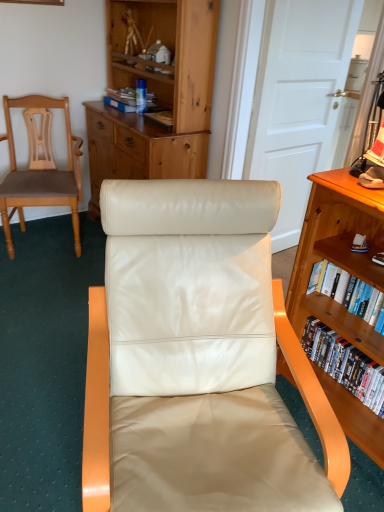
Locate an element on the screen. The image size is (384, 512). satin white leather chair at center, the 1th chair in the front-to-back sequence is located at coordinates (189, 312).

The image size is (384, 512). Describe the element at coordinates (298, 99) in the screenshot. I see `white wood door at upper center` at that location.

What do you see at coordinates (368, 139) in the screenshot? I see `metallic silver lamp at upper right` at bounding box center [368, 139].

Image resolution: width=384 pixels, height=512 pixels. Describe the element at coordinates (338, 254) in the screenshot. I see `wooden bookshelf at right` at that location.

Where is `satin white leather chair at center, which is the second chair in back-to-front order`? satin white leather chair at center, which is the second chair in back-to-front order is located at coordinates (189, 312).

Is matte brown wood chair at left, which is the second chair from front to back, not near satin white leather chair at center, the 1th chair in the front-to-back sequence?

Yes, matte brown wood chair at left, which is the second chair from front to back, and satin white leather chair at center, the 1th chair in the front-to-back sequence, are quite far apart.

From a real-world perspective, is matte brown wood chair at left, which is the second chair from front to back, positioned above or below satin white leather chair at center, marked as the second chair in a left-to-right arrangement?

matte brown wood chair at left, which is the second chair from front to back, is below satin white leather chair at center, marked as the second chair in a left-to-right arrangement.

From the image's perspective, which one is positioned lower, matte brown wood chair at left, the second chair viewed from the right, or satin white leather chair at center, marked as the second chair in a left-to-right arrangement?

satin white leather chair at center, marked as the second chair in a left-to-right arrangement, is shown below in the image.

Is point (377, 110) closer to camera compared to point (103, 434)?

No, it is not.

Considering the sizes of objects metallic silver lamp at upper right and satin white leather chair at center, the 1th chair in the front-to-back sequence, in the image provided, who is taller, metallic silver lamp at upper right or satin white leather chair at center, the 1th chair in the front-to-back sequence,?

satin white leather chair at center, the 1th chair in the front-to-back sequence.

Locate an element on the screen. lamp above the satin white leather chair at center, marked as the second chair in a left-to-right arrangement (from the image's perspective) is located at coordinates (368, 139).

Can you confirm if metallic silver lamp at upper right is taller than white glossy bookshelf at right, marked as the third book in a left-to-right arrangement?

Indeed, metallic silver lamp at upper right has a greater height compared to white glossy bookshelf at right, marked as the third book in a left-to-right arrangement.

Is metallic silver lamp at upper right facing away from white glossy bookshelf at right, marked as the third book in a left-to-right arrangement?

That's not correct — metallic silver lamp at upper right is not looking away from white glossy bookshelf at right, marked as the third book in a left-to-right arrangement.

Does metallic silver lamp at upper right have a smaller size compared to white glossy bookshelf at right, arranged as the first book when ordered from the bottom?

Indeed, metallic silver lamp at upper right has a smaller size compared to white glossy bookshelf at right, arranged as the first book when ordered from the bottom.

From the image's perspective, which one is positioned lower, metallic silver lamp at upper right or white glossy bookshelf at right, positioned as the 2th book in back-to-front order?

From the image's view, white glossy bookshelf at right, positioned as the 2th book in back-to-front order, is below.

Would you say matte brown wood chair at left, which is the second chair from front to back, contains white glossy bookshelf at right, positioned as the 2th book in back-to-front order?

That's incorrect, white glossy bookshelf at right, positioned as the 2th book in back-to-front order, is not inside matte brown wood chair at left, which is the second chair from front to back.

Would you consider matte brown wood chair at left, which is the second chair from front to back, to be distant from white glossy bookshelf at right, which appears as the first book when viewed from the right?

matte brown wood chair at left, which is the second chair from front to back, is positioned a significant distance from white glossy bookshelf at right, which appears as the first book when viewed from the right.

This screenshot has width=384, height=512. Find the location of `the 2nd chair to the left when counting from the white glossy bookshelf at right, which appears as the first book when viewed from the right`. the 2nd chair to the left when counting from the white glossy bookshelf at right, which appears as the first book when viewed from the right is located at coordinates (40, 168).

From a real-world perspective, relative to matte brown wood chair at left, which is the first chair in back-to-front order, is metallic silver lamp at upper right vertically above or below?

From a real-world perspective, metallic silver lamp at upper right is physically above matte brown wood chair at left, which is the first chair in back-to-front order.

Between metallic silver lamp at upper right and matte brown wood chair at left, which is the second chair from front to back, which one has more height?

matte brown wood chair at left, which is the second chair from front to back, is taller.

Could you tell me if metallic silver lamp at upper right is facing matte brown wood chair at left, the second chair viewed from the right?

No, metallic silver lamp at upper right is not oriented towards matte brown wood chair at left, the second chair viewed from the right.

I want to click on the 2nd chair to the left of the metallic silver lamp at upper right, counting from the anchor's position, so click(x=40, y=168).

Identify the location of door that appears behind the satin white leather chair at center, the first chair positioned from the right. (298, 99).

Which is closer to the camera, (302, 59) or (299, 351)?

Point (299, 351)

Based on the photo, does white wood door at upper center appear on the left side of satin white leather chair at center, marked as the second chair in a left-to-right arrangement?

In fact, white wood door at upper center is to the right of satin white leather chair at center, marked as the second chair in a left-to-right arrangement.

Between white wood door at upper center and satin white leather chair at center, the first chair positioned from the right, which one has less height?

satin white leather chair at center, the first chair positioned from the right, is shorter.

How many degrees apart are the facing directions of matte cardboard book at upper center, positioned as the first book in top-to-bottom order, and metallic silver lamp at upper right?

1.22 degrees separate the facing orientations of matte cardboard book at upper center, positioned as the first book in top-to-bottom order, and metallic silver lamp at upper right.

Which is closer, (115, 92) or (380, 119)?

Point (115, 92) is farther from the camera than point (380, 119).

This screenshot has width=384, height=512. Identify the location of the 1st book directly beneath the metallic silver lamp at upper right (from a real-world perspective). (121, 99).

Where is `chair above the matte brown wood chair at left, the second chair viewed from the right (from a real-world perspective)`? This screenshot has height=512, width=384. chair above the matte brown wood chair at left, the second chair viewed from the right (from a real-world perspective) is located at coordinates (189, 312).

Locate an element on the screen. chair that is the 1st one below the metallic silver lamp at upper right (from a real-world perspective) is located at coordinates (189, 312).

When comparing their distances from hardcover book at right, the 3th book in the back-to-front sequence, does wooden bookshelf at right or satin white leather chair at center, which is the second chair in back-to-front order, seem further?

satin white leather chair at center, which is the second chair in back-to-front order, is further to hardcover book at right, the 3th book in the back-to-front sequence.

Estimate the real-world distances between objects in this image. Which object is further from matte cardboard book at upper center, positioned as the first book in top-to-bottom order, satin white leather chair at center, the 1th chair in the front-to-back sequence, or white glossy bookshelf at right, which appears as the 3th book when viewed from the top?

white glossy bookshelf at right, which appears as the 3th book when viewed from the top, is positioned further to the anchor matte cardboard book at upper center, positioned as the first book in top-to-bottom order.

In the scene shown: When comparing their distances from matte brown wood chair at left, the first chair in the left-to-right sequence, does hardcover book at right, which ranks as the second book in top-to-bottom order, or white wood door at upper center seem closer?

white wood door at upper center is closer to matte brown wood chair at left, the first chair in the left-to-right sequence.

Which object lies further to the anchor point metallic silver lamp at upper right, white glossy bookshelf at right, which appears as the first book when viewed from the right, or wooden bookshelf at right?

Based on the image, white glossy bookshelf at right, which appears as the first book when viewed from the right, appears to be further to metallic silver lamp at upper right.

When comparing their distances from satin white leather chair at center, which is the second chair in back-to-front order, does metallic silver lamp at upper right or matte brown wood chair at left, which is the second chair from front to back, seem further?

The object further to satin white leather chair at center, which is the second chair in back-to-front order, is matte brown wood chair at left, which is the second chair from front to back.

Estimate the real-world distances between objects in this image. Which object is closer to matte brown wood chair at left, which is the second chair from front to back, matte cardboard book at upper center, the 3th book when ordered from right to left, or white glossy bookshelf at right, arranged as the first book when ordered from the bottom?

matte cardboard book at upper center, the 3th book when ordered from right to left.

From the image, which object appears to be farther from white wood door at upper center, metallic silver lamp at upper right or matte cardboard book at upper center, the 1th book positioned from the left?

Based on the image, matte cardboard book at upper center, the 1th book positioned from the left, appears to be further to white wood door at upper center.

From the image, which object appears to be nearer to satin white leather chair at center, which is the second chair in back-to-front order, white wood door at upper center or wooden bookshelf at right?

Among the two, wooden bookshelf at right is located nearer to satin white leather chair at center, which is the second chair in back-to-front order.

At what (x,y) coordinates should I click in order to perform the action: click on door positioned between metallic silver lamp at upper right and matte cardboard book at upper center, the 3th book in the front-to-back sequence, from near to far. Please return your answer as a coordinate pair (x, y). The image size is (384, 512). Looking at the image, I should click on (298, 99).

Identify the location of book that lies between matte cardboard book at upper center, positioned as the first book in top-to-bottom order, and white glossy bookshelf at right, which appears as the first book when viewed from the right, from top to bottom. This screenshot has height=512, width=384. (348, 293).

Find the location of a particular element. shelf between metallic silver lamp at upper right and white glossy bookshelf at right, arranged as the 2th book when viewed from the front, in the vertical direction is located at coordinates [x=338, y=254].

Identify the location of book located between wooden bookshelf at right and white glossy bookshelf at right, marked as the third book in a left-to-right arrangement, in the depth direction. (348, 293).